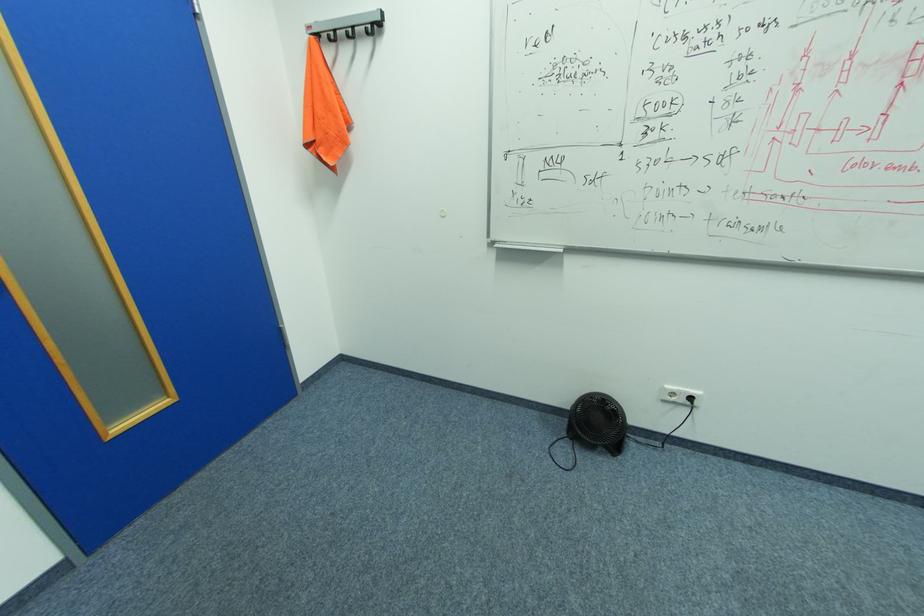
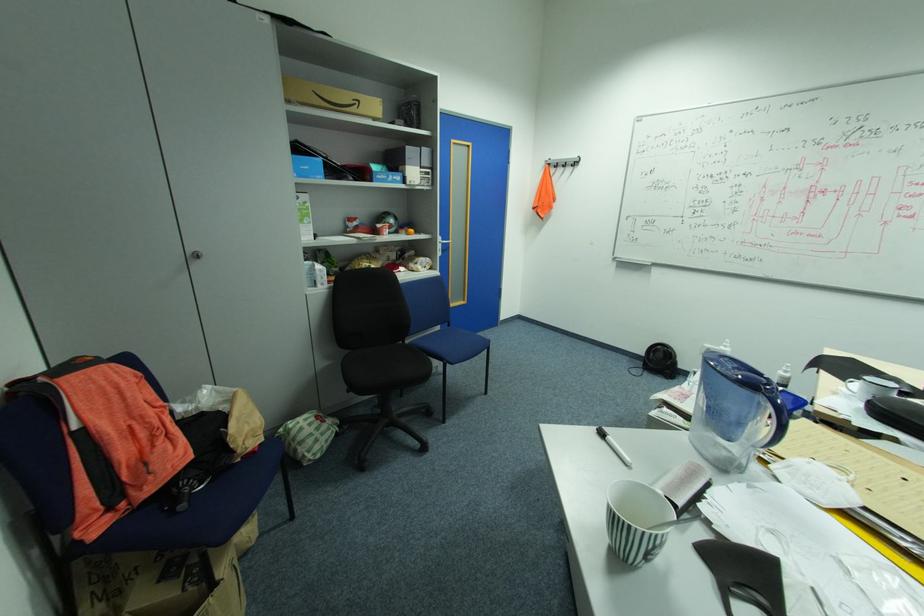
Question: Which direction would the cameraman need to move to produce the second image? Reply with the corresponding letter.

Choices:
 (A) Left
 (B) Right
 (C) Forward
 (D) Backward

Answer: (D)